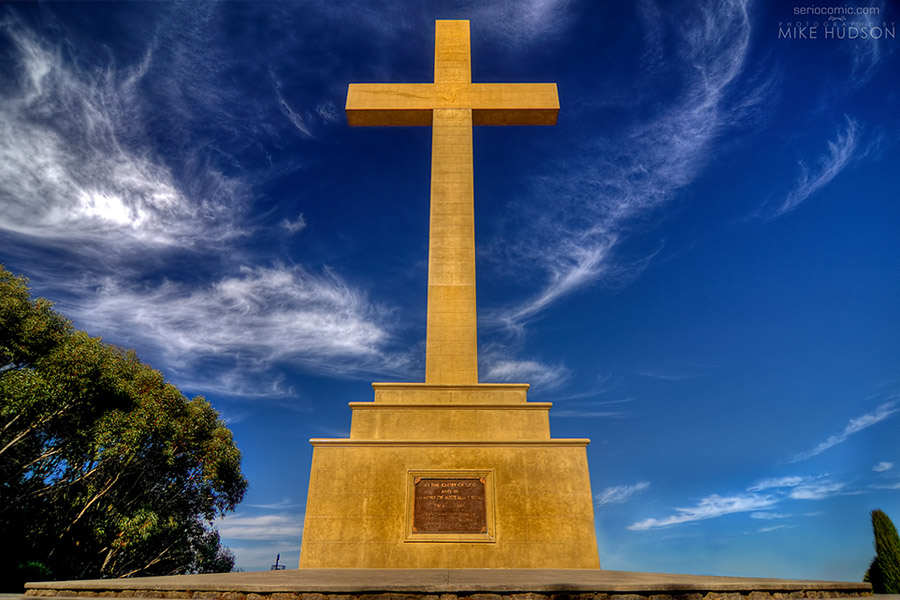
The image size is (900, 600). I want to click on plaque, so click(x=447, y=500).